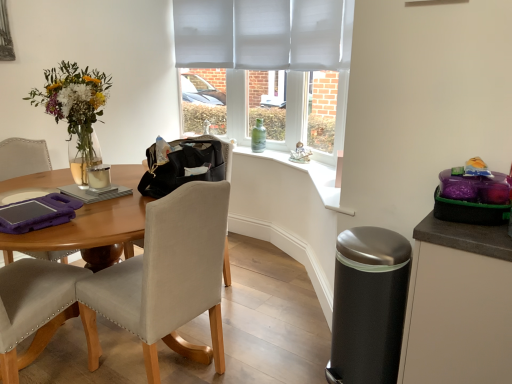
Question: From a real-world perspective, relative to matte white mug at table, is green glass bottle at window vertically above or below?

Choices:
 (A) below
 (B) above

Answer: (A)

Question: Considering the positions of green glass bottle at window and matte white mug at table in the image, is green glass bottle at window wider or thinner than matte white mug at table?

Choices:
 (A) thin
 (B) wide

Answer: (B)

Question: Which object is the closest to the matte white mug at table?

Choices:
 (A) beige fabric chair at left
 (B) black leather handbag at center
 (C) matte black cabinet at right
 (D) satin black trash can at lower right
 (E) green glass bottle at window

Answer: (B)

Question: Which is farther from the beige fabric chair at left?

Choices:
 (A) matte black cabinet at right
 (B) black leather handbag at center
 (C) green glass bottle at window
 (D) matte white mug at table
 (E) satin black trash can at lower right

Answer: (C)